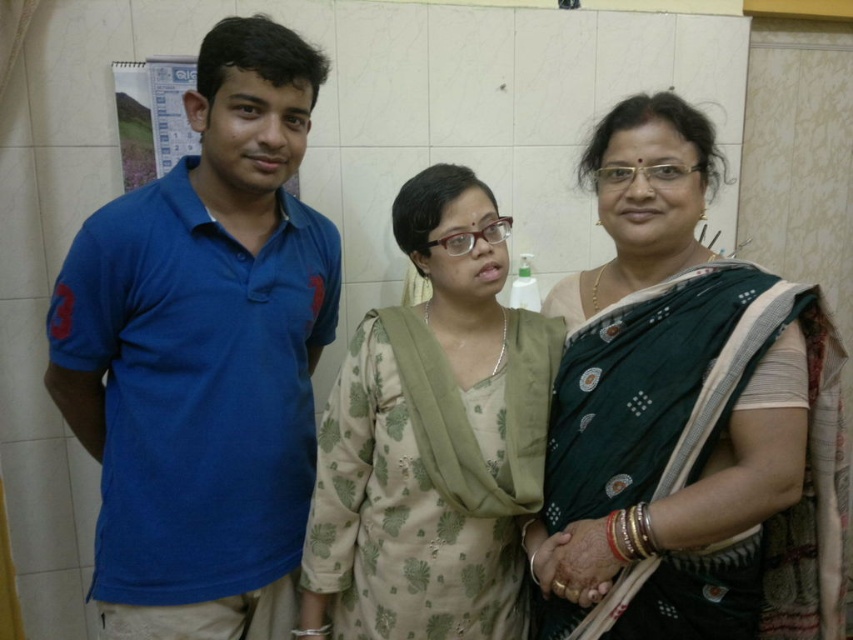
The width and height of the screenshot is (853, 640). What do you see at coordinates (204, 355) in the screenshot?
I see `blue cotton polo shirt at left` at bounding box center [204, 355].

This screenshot has height=640, width=853. I want to click on blue cotton polo shirt at left, so click(204, 355).

The height and width of the screenshot is (640, 853). Find the location of `blue cotton polo shirt at left`. blue cotton polo shirt at left is located at coordinates (204, 355).

In order to click on blue cotton polo shirt at left in this screenshot , I will do `click(204, 355)`.

Is green silk saree at center wider than light beige floral dress at center?

Correct, the width of green silk saree at center exceeds that of light beige floral dress at center.

Is green silk saree at center thinner than light beige floral dress at center?

In fact, green silk saree at center might be wider than light beige floral dress at center.

What do you see at coordinates (688, 417) in the screenshot? This screenshot has height=640, width=853. I see `green silk saree at center` at bounding box center [688, 417].

Locate an element on the screen. green silk saree at center is located at coordinates (688, 417).

Is point (198, 129) in front of point (442, 308)?

That is True.

Does point (138, 236) come behind point (387, 545)?

No.

This screenshot has width=853, height=640. I want to click on blue cotton polo shirt at left, so click(x=204, y=355).